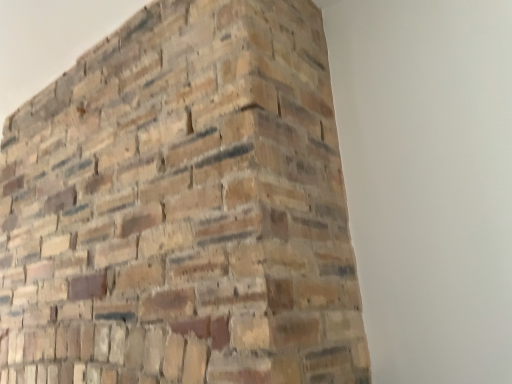
Locate an element on the screen. natural stone tower at center is located at coordinates (182, 208).

Describe the element at coordinates (182, 208) in the screenshot. I see `natural stone tower at center` at that location.

Measure the distance between natural stone tower at center and camera.

The distance of natural stone tower at center from camera is 36.50 inches.

At what (x,y) coordinates should I click in order to perform the action: click on natural stone tower at center. Please return your answer as a coordinate pair (x, y). This screenshot has width=512, height=384. Looking at the image, I should click on (182, 208).